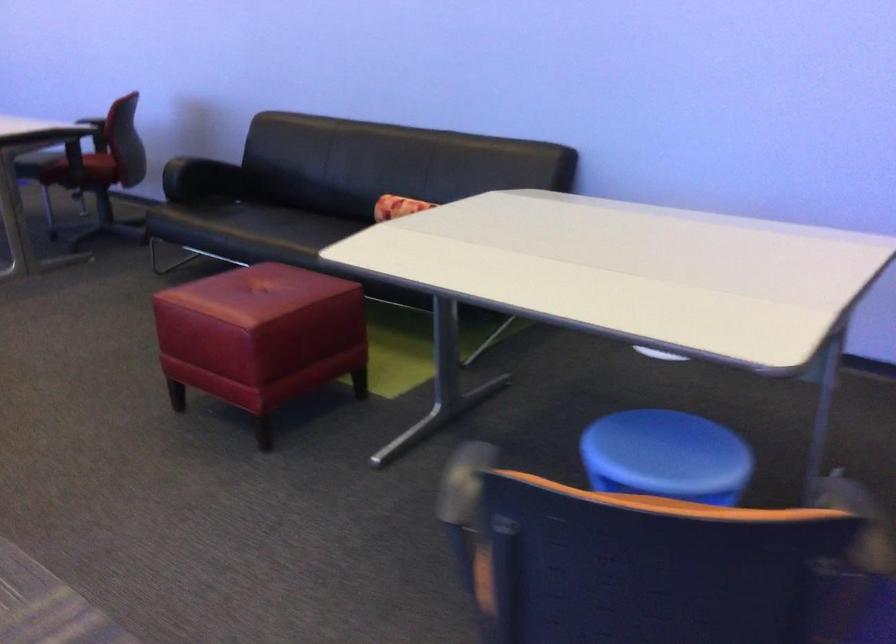
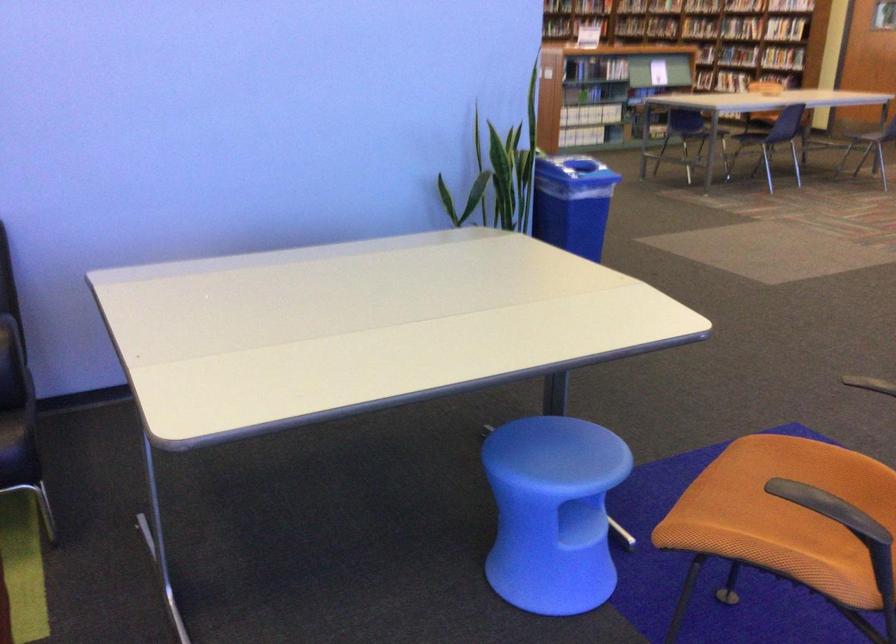
Question: I am providing you with two images of the same scene from different viewpoints. Which of the following objects are not visible in image2?

Choices:
 (A) blue plastic stool
 (B) blue recycling bin
 (C) orange chair sitting surface
 (D) none of these

Answer: (D)